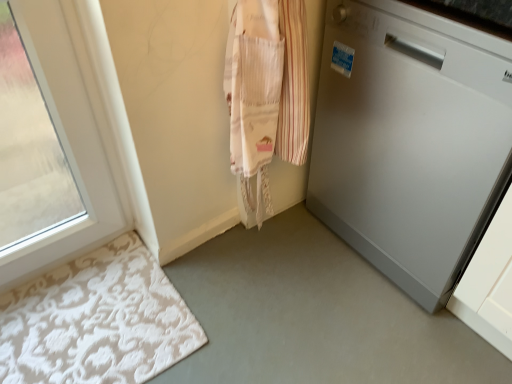
Question: Is white glossy dishwasher at right taller or shorter than white textured bath mat at lower left?

Choices:
 (A) tall
 (B) short

Answer: (A)

Question: Is white glossy dishwasher at right inside or outside of white textured bath mat at lower left?

Choices:
 (A) inside
 (B) outside

Answer: (B)

Question: Considering the positions of white glossy dishwasher at right and white textured bath mat at lower left in the image, is white glossy dishwasher at right wider or thinner than white textured bath mat at lower left?

Choices:
 (A) thin
 (B) wide

Answer: (B)

Question: From the image's perspective, is white textured bath mat at lower left located above or below white glossy dishwasher at right?

Choices:
 (A) above
 (B) below

Answer: (B)

Question: From a real-world perspective, relative to white glossy dishwasher at right, is white textured bath mat at lower left vertically above or below?

Choices:
 (A) above
 (B) below

Answer: (B)

Question: Considering the positions of white textured bath mat at lower left and white glossy dishwasher at right in the image, is white textured bath mat at lower left wider or thinner than white glossy dishwasher at right?

Choices:
 (A) wide
 (B) thin

Answer: (B)

Question: Does point (151, 291) appear closer or farther from the camera than point (329, 147)?

Choices:
 (A) closer
 (B) farther

Answer: (A)